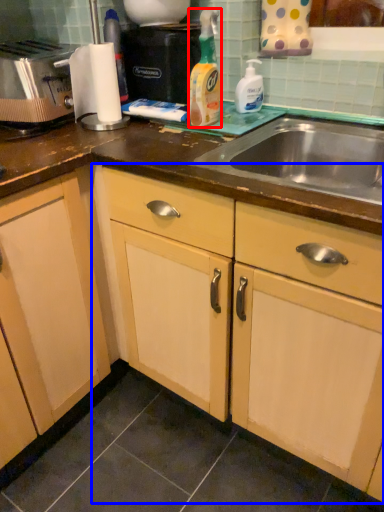
Question: Which object is closer to the camera taking this photo, cleaning product (highlighted by a red box) or cabinetry (highlighted by a blue box)?

Choices:
 (A) cleaning product
 (B) cabinetry

Answer: (B)